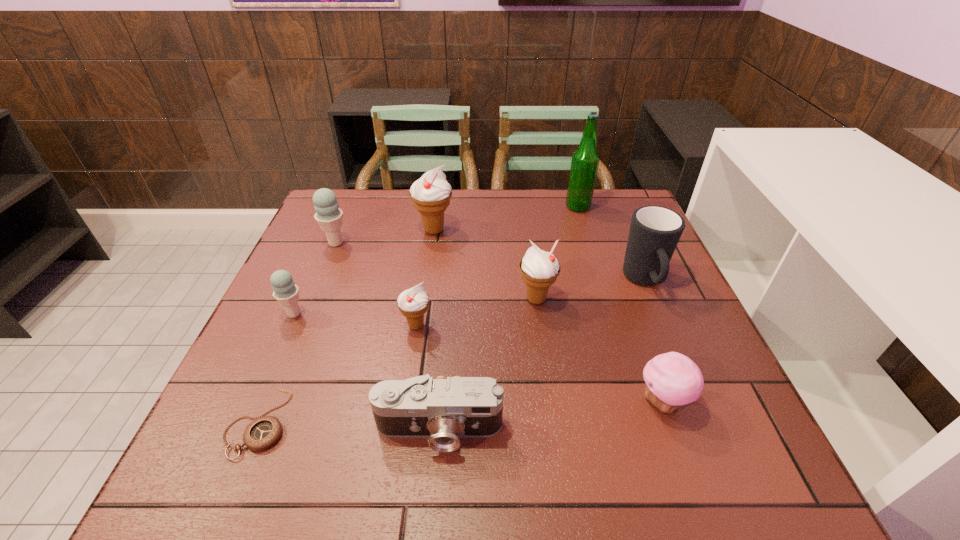
The width and height of the screenshot is (960, 540). Find the location of `pink cupcake`. pink cupcake is located at coordinates (672, 379).

Locate an element on the screen. camera is located at coordinates (443, 410).

This screenshot has height=540, width=960. Identify the location of the shortest object. [x=263, y=432].

I want to click on free space located 0.390m on the label of the beer bottle, so click(440, 207).

The image size is (960, 540). I want to click on vacant space situated 0.300m on the label of the beer bottle, so click(x=468, y=207).

The width and height of the screenshot is (960, 540). In order to click on vacant area located on the label of the beer bottle in this screenshot , I will do `click(440, 207)`.

Where is `vacant area situated 0.270m on the front of the ninth shortest object`? vacant area situated 0.270m on the front of the ninth shortest object is located at coordinates (423, 310).

Locate an element on the screen. Image resolution: width=960 pixels, height=540 pixels. vacant space located 0.190m on the side of the mug with the handle is located at coordinates (683, 372).

Where is `vacant space located on the front of the farther blue ice cream`? The height and width of the screenshot is (540, 960). vacant space located on the front of the farther blue ice cream is located at coordinates point(324,269).

Identify the location of blank space located on the left of the seventh object from left to right. The width and height of the screenshot is (960, 540). (426, 299).